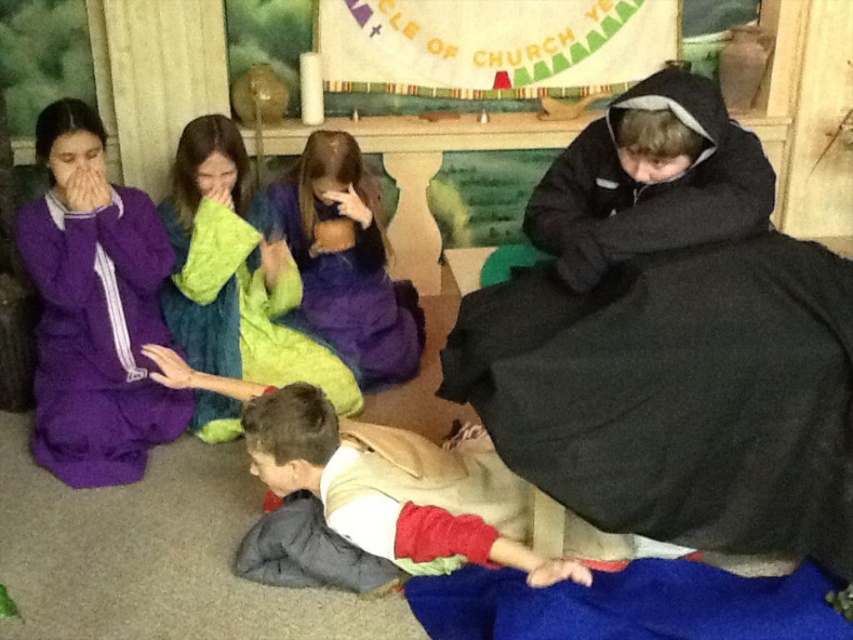
Question: Is tan fabric child at lower center positioned before purple fleece blanket at center?

Choices:
 (A) no
 (B) yes

Answer: (B)

Question: Which object is positioned closest to the purple fleece blanket at center?

Choices:
 (A) black fleece blanket at right
 (B) purple fleece robe at left
 (C) tan fabric child at lower center
 (D) green fuzzy blanket at center

Answer: (D)

Question: Which point appears closest to the camera in this image?

Choices:
 (A) click(102, 477)
 (B) click(270, 198)
 (C) click(370, 444)
 (D) click(239, 176)

Answer: (C)

Question: Which of the following is the closest to the observer?

Choices:
 (A) [119, 406]
 (B) [334, 276]
 (C) [601, 566]

Answer: (C)

Question: From the image, what is the correct spatial relationship of purple fleece blanket at center in relation to green fuzzy blanket at center?

Choices:
 (A) above
 (B) below

Answer: (A)

Question: Is purple fleece robe at left positioned at the back of purple fleece blanket at center?

Choices:
 (A) yes
 (B) no

Answer: (B)